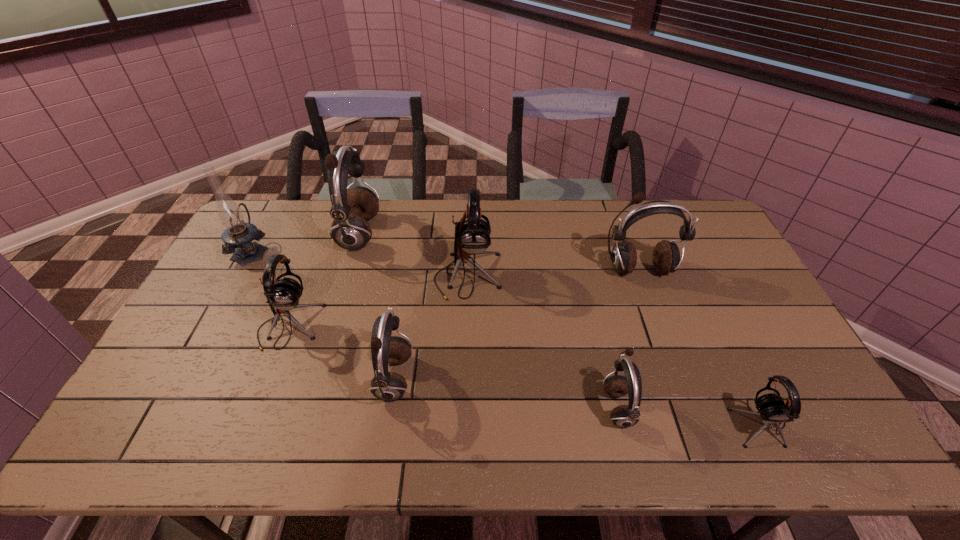
I want to click on vacant area that lies between the third earphone from right to left and the third smallest brown earphone, so click(628, 338).

Locate an element on the screen. This screenshot has width=960, height=540. free space between the third brown earphone from left to right and the rightmost brown earphone is located at coordinates (628, 338).

Identify the location of free space between the second brown earphone from right to left and the second smallest black earphone. (453, 367).

Locate which object is the seventh closest to the smallest black earphone. Please provide its 2D coordinates. Your answer should be formatted as a tuple, i.e. [(x, y)], where the tuple contains the x and y coordinates of a point satisfying the conditions above.

[(238, 235)]

You are a GUI agent. You are given a task and a screenshot of the screen. Output one action in this format:
    pyautogui.click(x=<x>, y=<y>)
    Task: Click on the object that ranks as the sixth closest to the rightmost brown earphone
    The width and height of the screenshot is (960, 540).
    Given the screenshot: What is the action you would take?
    pyautogui.click(x=283, y=294)

Locate an element on the screen. The image size is (960, 540). earphone that is the second closest one to the rightmost black earphone is located at coordinates (666, 259).

Find the location of a particular element. The height and width of the screenshot is (540, 960). earphone that is the third closest one to the second black earphone from right to left is located at coordinates (283, 294).

Identify the location of brown earphone object that ranks as the second closest to the third smallest brown earphone. The height and width of the screenshot is (540, 960). (388, 386).

Choose which brown earphone is the nearest neighbor to the second smallest brown earphone. Please provide its 2D coordinates. Your answer should be formatted as a tuple, i.e. [(x, y)], where the tuple contains the x and y coordinates of a point satisfying the conditions above.

[(351, 209)]

This screenshot has height=540, width=960. I want to click on black earphone that is the closest to the nearest black earphone, so click(x=472, y=235).